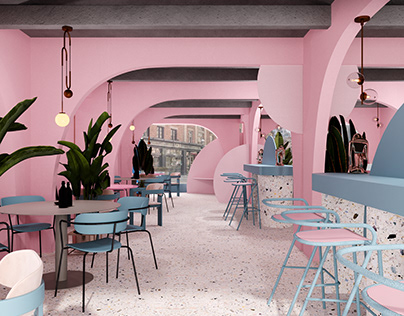
Locate an element on the screen. table is located at coordinates (38, 208).